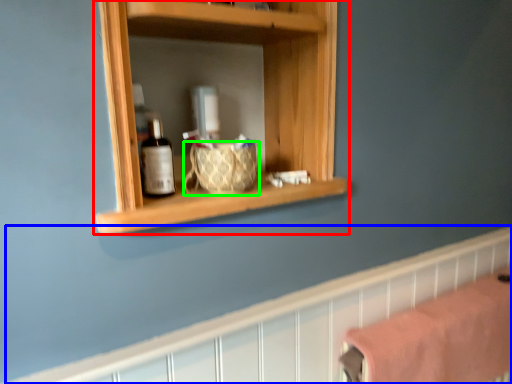
Question: Which is farther away from shelf (highlighted by a red box)? ledge (highlighted by a blue box) or basket (highlighted by a green box)?

Choices:
 (A) ledge
 (B) basket

Answer: (A)